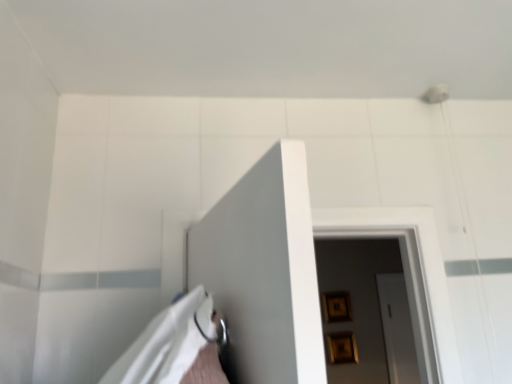
What is the approximate height of wooden picture frame at center, the 1th picture frame in the bottom-to-top sequence?

wooden picture frame at center, the 1th picture frame in the bottom-to-top sequence, is 9.34 inches tall.

What do you see at coordinates (341, 348) in the screenshot?
I see `wooden picture frame at center, positioned as the 2th picture frame in top-to-bottom order` at bounding box center [341, 348].

In order to click on wooden picture frame at center, positioned as the 2th picture frame in top-to-bottom order in this screenshot , I will do `click(341, 348)`.

This screenshot has width=512, height=384. What do you see at coordinates (336, 307) in the screenshot?
I see `gold metallic picture frame at upper center, the 2th picture frame positioned from the bottom` at bounding box center [336, 307].

Identify the location of gold metallic picture frame at upper center, the 1th picture frame from the top. Image resolution: width=512 pixels, height=384 pixels. (336, 307).

Find the location of a particular element. The width and height of the screenshot is (512, 384). wooden picture frame at center, positioned as the 2th picture frame in top-to-bottom order is located at coordinates tap(341, 348).

Is wooden picture frame at center, the 1th picture frame in the bottom-to-top sequence, to the left or to the right of gold metallic picture frame at upper center, the 1th picture frame from the top, in the image?

From the image, it's evident that wooden picture frame at center, the 1th picture frame in the bottom-to-top sequence, is to the right of gold metallic picture frame at upper center, the 1th picture frame from the top.

Is the position of wooden picture frame at center, positioned as the 2th picture frame in top-to-bottom order, less distant than that of gold metallic picture frame at upper center, the 1th picture frame from the top?

That is True.

Between point (350, 348) and point (339, 317), which one is positioned behind?

The point (339, 317) is more distant.

From the image's perspective, which is above, wooden picture frame at center, the 1th picture frame in the bottom-to-top sequence, or gold metallic picture frame at upper center, the 1th picture frame from the top?

From the image's view, gold metallic picture frame at upper center, the 1th picture frame from the top, is above.

From a real-world perspective, is wooden picture frame at center, the 1th picture frame in the bottom-to-top sequence, located higher than gold metallic picture frame at upper center, the 2th picture frame positioned from the bottom?

No, from a real-world perspective, wooden picture frame at center, the 1th picture frame in the bottom-to-top sequence, is not on top of gold metallic picture frame at upper center, the 2th picture frame positioned from the bottom.

Between wooden picture frame at center, positioned as the 2th picture frame in top-to-bottom order, and gold metallic picture frame at upper center, the 1th picture frame from the top, which one has smaller width?

gold metallic picture frame at upper center, the 1th picture frame from the top, is thinner.

Is wooden picture frame at center, positioned as the 2th picture frame in top-to-bottom order, taller or shorter than gold metallic picture frame at upper center, the 1th picture frame from the top?

Clearly, wooden picture frame at center, positioned as the 2th picture frame in top-to-bottom order, is shorter compared to gold metallic picture frame at upper center, the 1th picture frame from the top.

Which of these two, wooden picture frame at center, the 1th picture frame in the bottom-to-top sequence, or gold metallic picture frame at upper center, the 2th picture frame positioned from the bottom, is bigger?

Bigger between the two is wooden picture frame at center, the 1th picture frame in the bottom-to-top sequence.

Would you say wooden picture frame at center, the 1th picture frame in the bottom-to-top sequence, is outside gold metallic picture frame at upper center, the 1th picture frame from the top?

Yes, wooden picture frame at center, the 1th picture frame in the bottom-to-top sequence, is outside of gold metallic picture frame at upper center, the 1th picture frame from the top.

Is wooden picture frame at center, the 1th picture frame in the bottom-to-top sequence, positioned far away from gold metallic picture frame at upper center, the 1th picture frame from the top?

No.

Does wooden picture frame at center, positioned as the 2th picture frame in top-to-bottom order, turn towards gold metallic picture frame at upper center, the 1th picture frame from the top?

No, wooden picture frame at center, positioned as the 2th picture frame in top-to-bottom order, is not facing towards gold metallic picture frame at upper center, the 1th picture frame from the top.

How different are the orientations of wooden picture frame at center, the 1th picture frame in the bottom-to-top sequence, and gold metallic picture frame at upper center, the 2th picture frame positioned from the bottom, in degrees?

They differ by 0.00718 degrees in their facing directions.

Image resolution: width=512 pixels, height=384 pixels. Find the location of `picture frame above the wooden picture frame at center, positioned as the 2th picture frame in top-to-bottom order (from a real-world perspective)`. picture frame above the wooden picture frame at center, positioned as the 2th picture frame in top-to-bottom order (from a real-world perspective) is located at coordinates (336, 307).

Between gold metallic picture frame at upper center, the 1th picture frame from the top, and wooden picture frame at center, the 1th picture frame in the bottom-to-top sequence, which one appears on the left side from the viewer's perspective?

gold metallic picture frame at upper center, the 1th picture frame from the top, is more to the left.

Is the position of gold metallic picture frame at upper center, the 2th picture frame positioned from the bottom, more distant than that of wooden picture frame at center, the 1th picture frame in the bottom-to-top sequence?

Yes, it is behind wooden picture frame at center, the 1th picture frame in the bottom-to-top sequence.

Which point is more distant from viewer, (338, 313) or (355, 343)?

Positioned behind is point (338, 313).

From the image's perspective, between gold metallic picture frame at upper center, the 2th picture frame positioned from the bottom, and wooden picture frame at center, positioned as the 2th picture frame in top-to-bottom order, which one is located above?

gold metallic picture frame at upper center, the 2th picture frame positioned from the bottom, from the image's perspective.

From a real-world perspective, does gold metallic picture frame at upper center, the 2th picture frame positioned from the bottom, sit lower than wooden picture frame at center, the 1th picture frame in the bottom-to-top sequence?

No.

Which of these two, gold metallic picture frame at upper center, the 2th picture frame positioned from the bottom, or wooden picture frame at center, positioned as the 2th picture frame in top-to-bottom order, is thinner?

With smaller width is gold metallic picture frame at upper center, the 2th picture frame positioned from the bottom.

Does gold metallic picture frame at upper center, the 2th picture frame positioned from the bottom, have a lesser height compared to wooden picture frame at center, positioned as the 2th picture frame in top-to-bottom order?

Incorrect, the height of gold metallic picture frame at upper center, the 2th picture frame positioned from the bottom, does not fall short of that of wooden picture frame at center, positioned as the 2th picture frame in top-to-bottom order.

Which of these two, gold metallic picture frame at upper center, the 1th picture frame from the top, or wooden picture frame at center, the 1th picture frame in the bottom-to-top sequence, is bigger?

Bigger between the two is wooden picture frame at center, the 1th picture frame in the bottom-to-top sequence.

Is wooden picture frame at center, positioned as the 2th picture frame in top-to-bottom order, surrounded by gold metallic picture frame at upper center, the 1th picture frame from the top?

No.

Are gold metallic picture frame at upper center, the 1th picture frame from the top, and wooden picture frame at center, the 1th picture frame in the bottom-to-top sequence, far apart?

Actually, gold metallic picture frame at upper center, the 1th picture frame from the top, and wooden picture frame at center, the 1th picture frame in the bottom-to-top sequence, are a little close together.

Is gold metallic picture frame at upper center, the 2th picture frame positioned from the bottom, aimed at wooden picture frame at center, positioned as the 2th picture frame in top-to-bottom order?

No, gold metallic picture frame at upper center, the 2th picture frame positioned from the bottom, is not aimed at wooden picture frame at center, positioned as the 2th picture frame in top-to-bottom order.

How different are the orientations of gold metallic picture frame at upper center, the 1th picture frame from the top, and wooden picture frame at center, positioned as the 2th picture frame in top-to-bottom order, in degrees?

The angular difference between gold metallic picture frame at upper center, the 1th picture frame from the top, and wooden picture frame at center, positioned as the 2th picture frame in top-to-bottom order, is 0.00718 degrees.

Where is `picture frame behind the wooden picture frame at center, positioned as the 2th picture frame in top-to-bottom order`? The width and height of the screenshot is (512, 384). picture frame behind the wooden picture frame at center, positioned as the 2th picture frame in top-to-bottom order is located at coordinates (336, 307).

The image size is (512, 384). Find the location of `picture frame lying on the left of wooden picture frame at center, the 1th picture frame in the bottom-to-top sequence`. picture frame lying on the left of wooden picture frame at center, the 1th picture frame in the bottom-to-top sequence is located at coordinates (336, 307).

Identify the location of picture frame that appears below the gold metallic picture frame at upper center, the 1th picture frame from the top (from a real-world perspective). (341, 348).